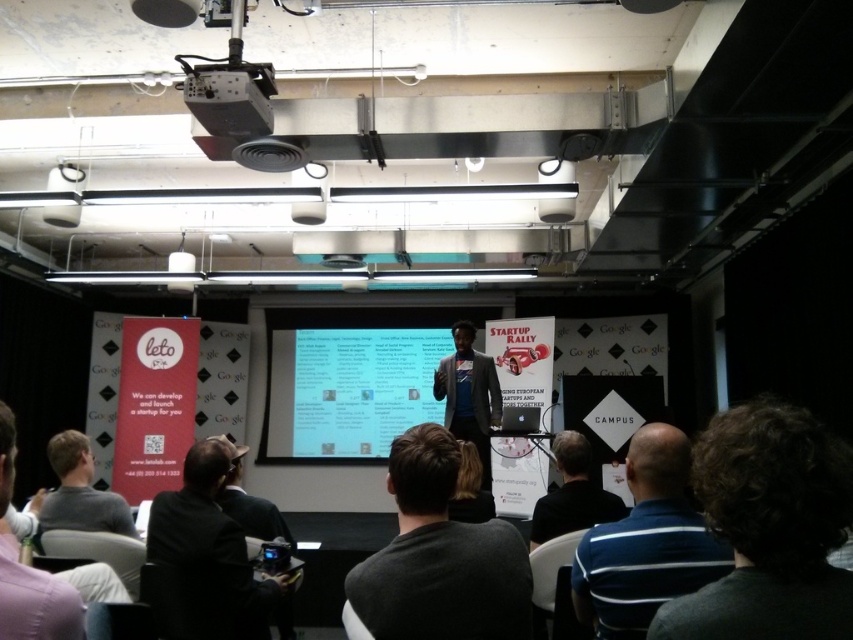
Can you confirm if dark gray sweater at center is positioned to the left of blue striped shirt at lower right?

Indeed, dark gray sweater at center is positioned on the left side of blue striped shirt at lower right.

Is dark gray sweater at center closer to camera compared to blue striped shirt at lower right?

No, dark gray sweater at center is behind blue striped shirt at lower right.

This screenshot has height=640, width=853. What are the coordinates of `dark gray sweater at center` in the screenshot? It's located at (x=440, y=556).

I want to click on dark gray sweater at center, so click(440, 556).

Who is taller, white matte projection screen at center or matte black projector at upper center?

white matte projection screen at center is taller.

From the picture: Is white matte projection screen at center behind matte black projector at upper center?

Yes, it is.

Which is behind, point (286, 397) or point (230, 134)?

The point (286, 397) is behind.

Locate an element on the screen. Image resolution: width=853 pixels, height=640 pixels. white matte projection screen at center is located at coordinates (351, 378).

Who is positioned more to the left, gray sweater at lower left or dark gray jacket at lower center?

From the viewer's perspective, gray sweater at lower left appears more on the left side.

You are a GUI agent. You are given a task and a screenshot of the screen. Output one action in this format:
    pyautogui.click(x=<x>, y=<y>)
    Task: Click on the gray sweater at lower left
    
    Given the screenshot: What is the action you would take?
    pyautogui.click(x=80, y=492)